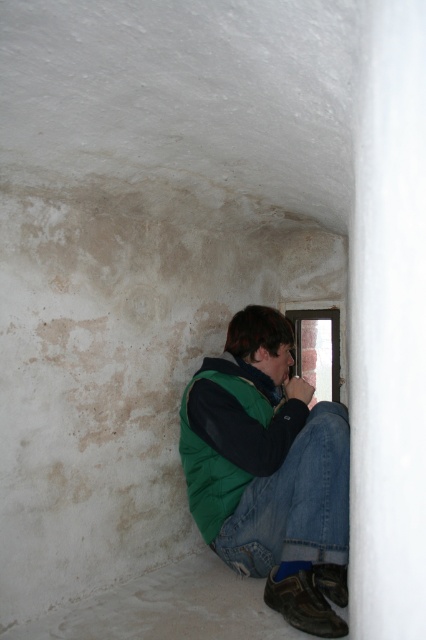
Does jeans at lower right have a lesser height compared to green puffy jacket at lower center?

Indeed, jeans at lower right has a lesser height compared to green puffy jacket at lower center.

Is jeans at lower right bigger than green puffy jacket at lower center?

Incorrect, jeans at lower right is not larger than green puffy jacket at lower center.

Identify the location of jeans at lower right. The image size is (426, 640). (294, 502).

Locate an element on the screen. This screenshot has width=426, height=640. jeans at lower right is located at coordinates (294, 502).

Who is positioned more to the right, green puffy vest at lower center or green puffy jacket at lower center?

green puffy vest at lower center

Can you confirm if green puffy vest at lower center is shorter than green puffy jacket at lower center?

In fact, green puffy vest at lower center may be taller than green puffy jacket at lower center.

What do you see at coordinates (270, 472) in the screenshot? The image size is (426, 640). I see `green puffy vest at lower center` at bounding box center [270, 472].

Identify the location of green puffy vest at lower center. This screenshot has height=640, width=426. click(270, 472).

Is point (336, 602) positioned in front of point (319, 531)?

No, it is not.

Which of these two, green puffy vest at lower center or jeans at lower right, stands taller?

Standing taller between the two is green puffy vest at lower center.

Image resolution: width=426 pixels, height=640 pixels. What do you see at coordinates (270, 472) in the screenshot? I see `green puffy vest at lower center` at bounding box center [270, 472].

You are a GUI agent. You are given a task and a screenshot of the screen. Output one action in this format:
    pyautogui.click(x=<x>, y=<y>)
    Task: Click on the green puffy vest at lower center
    
    Given the screenshot: What is the action you would take?
    click(270, 472)